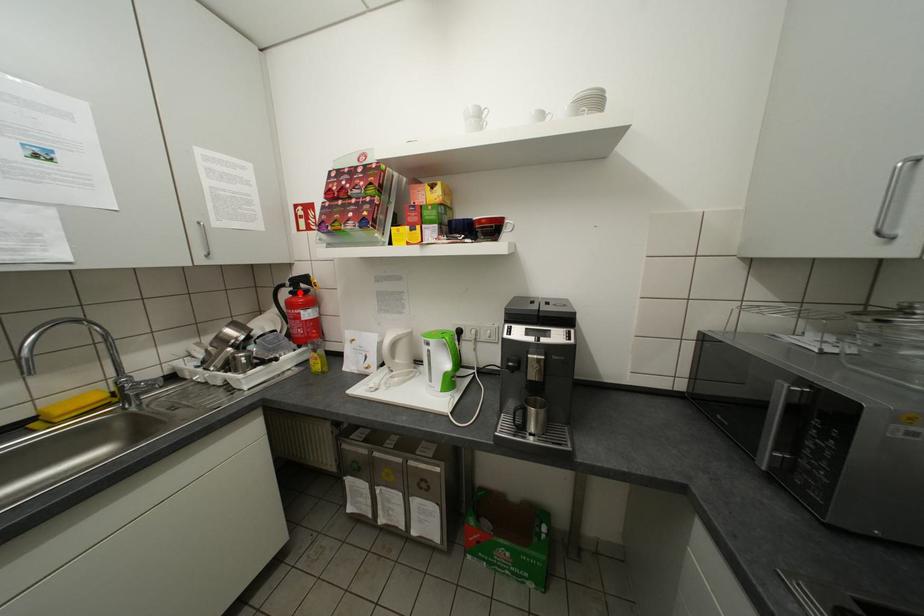
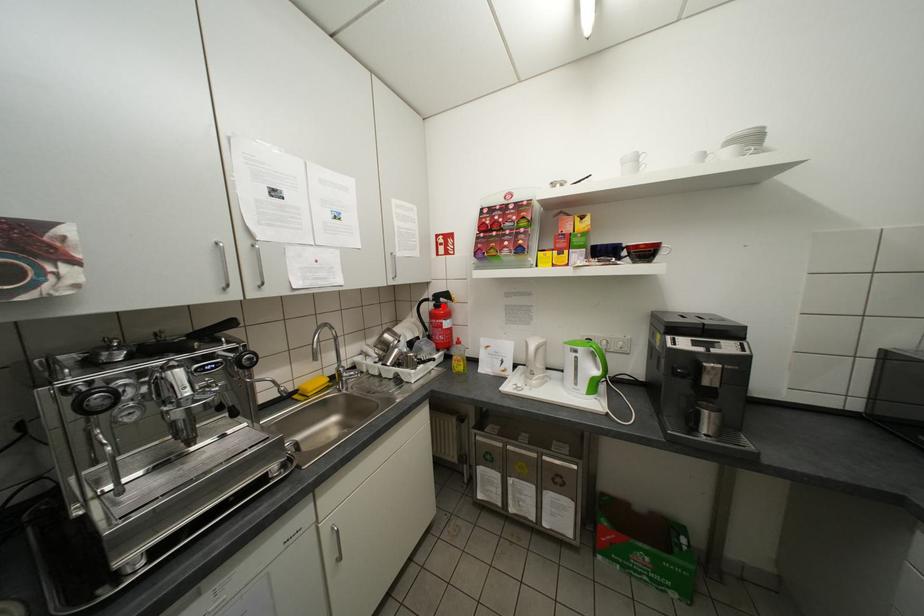
I am providing you with two images of the same scene from different viewpoints. A red point is marked on the first image and another point is marked on the second image. Is the marked point in image1 the same physical position as the marked point in image2?

Yes